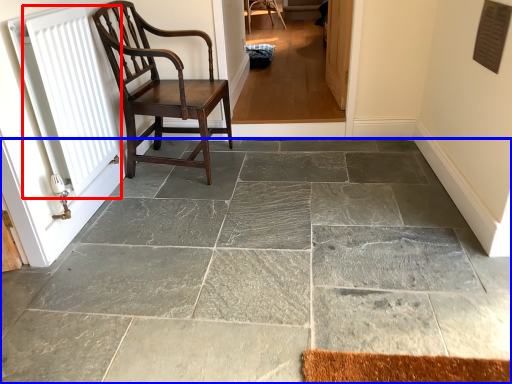
Question: Among these objects, which one is farthest to the camera, radiator (highlighted by a red box) or concrete (highlighted by a blue box)?

Choices:
 (A) radiator
 (B) concrete

Answer: (A)